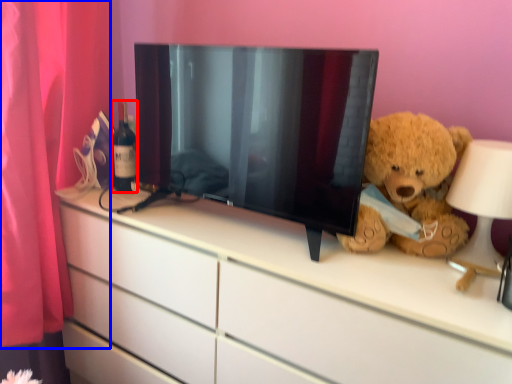
Question: Which of the following is the closest to the observer, bottle (highlighted by a red box) or curtain (highlighted by a blue box)?

Choices:
 (A) bottle
 (B) curtain

Answer: (B)